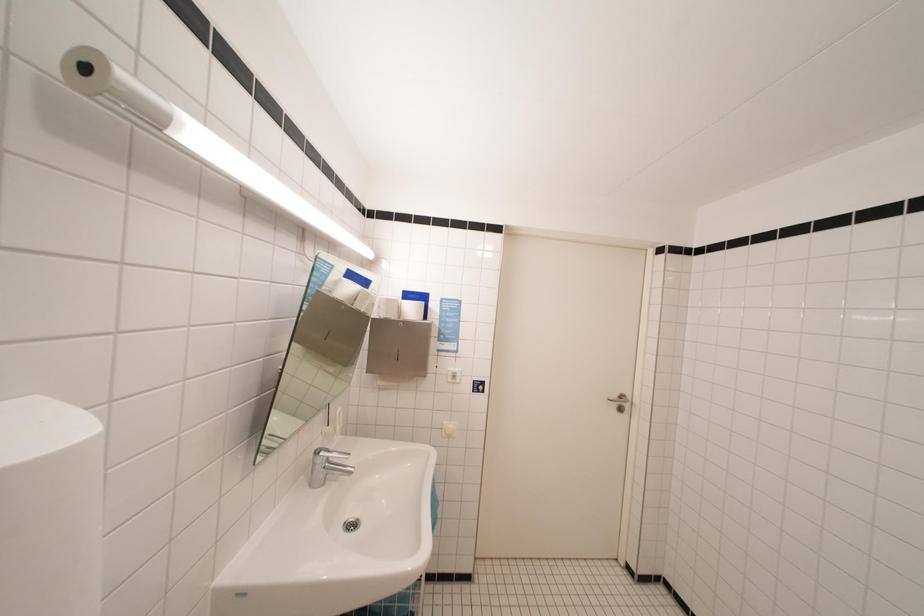
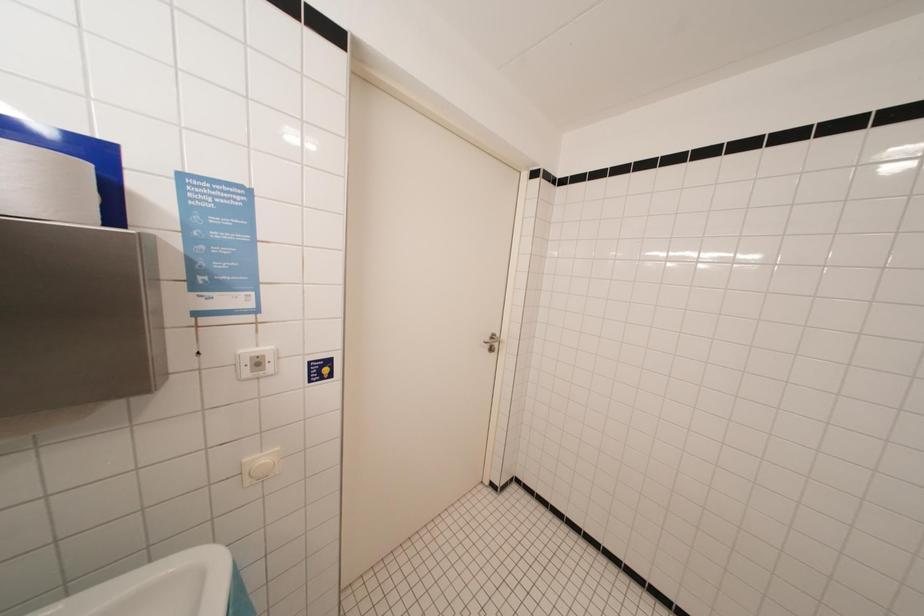
Question: The camera is either moving clockwise (left) or counter-clockwise (right) around the object. The first image is from the beginning of the video and the second image is from the end. Is the camera moving left or right when shooting the video?

Choices:
 (A) Left
 (B) Right

Answer: (A)